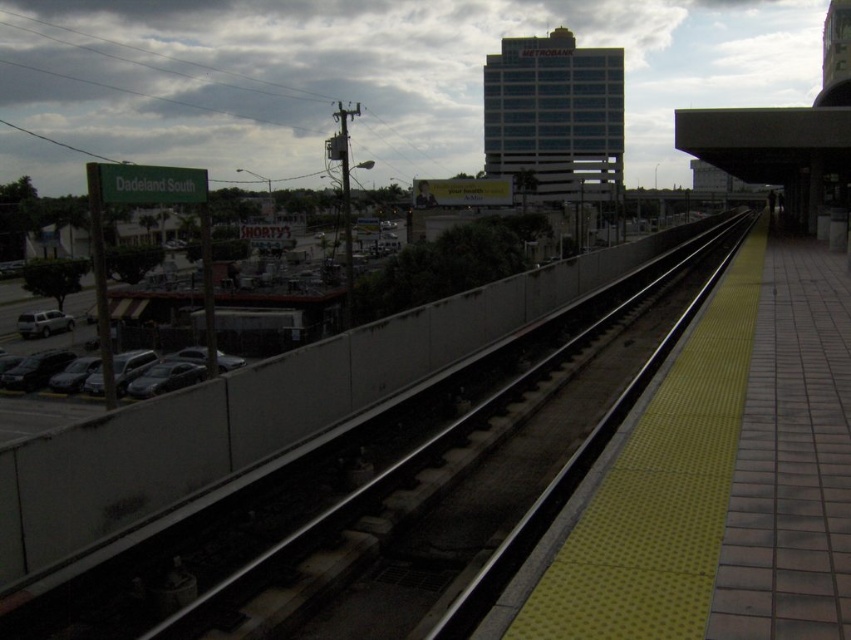
You are a delivery person who needs to unload a package onto the black asphalt train track at center. The dark gray metallic car at left is parked nearby. Considering their widths, can the car fit entirely on the train track without overlapping?

The black asphalt train track at center is wider than the dark gray metallic car at left, so the car can fit entirely on the train track without overlapping.